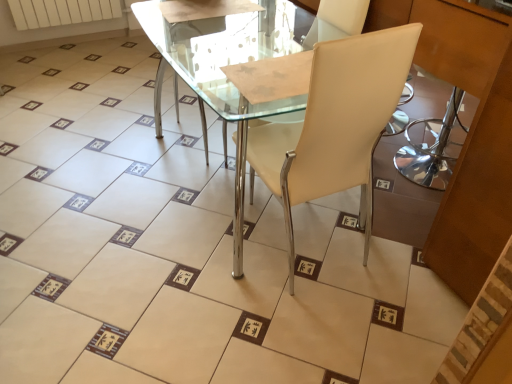
What do you see at coordinates (335, 125) in the screenshot?
I see `beige leather chair at center` at bounding box center [335, 125].

Image resolution: width=512 pixels, height=384 pixels. I want to click on beige leather chair at center, so click(x=335, y=125).

Find the location of a particular element. Image resolution: width=512 pixels, height=384 pixels. round table on the left side of beige leather chair at center is located at coordinates (209, 55).

Does transparent glass table at center have a smaller size compared to beige leather chair at center?

Yes.

In the image, is transparent glass table at center on the left side or the right side of beige leather chair at center?

Clearly, transparent glass table at center is on the left of beige leather chair at center in the image.

Who is shorter, white matte radiator at upper left or beige leather chair at center?

With less height is white matte radiator at upper left.

Considering the sizes of objects white matte radiator at upper left and beige leather chair at center in the image provided, who is thinner, white matte radiator at upper left or beige leather chair at center?

white matte radiator at upper left.

Looking at this image, from a real-world perspective, is white matte radiator at upper left above or below beige leather chair at center?

In terms of real-world spatial position, white matte radiator at upper left is below beige leather chair at center.

In order to click on chair that is below the white matte radiator at upper left (from the image's perspective) in this screenshot , I will do `click(335, 125)`.

From a real-world perspective, which object stands above the other?

beige leather chair at center is physically above.

I want to click on round table that is above the beige leather chair at center (from the image's perspective), so click(x=209, y=55).

Which of these two, beige leather chair at center or transparent glass table at center, is smaller?

With smaller size is transparent glass table at center.

Choose the correct answer: Is transparent glass table at center inside white matte radiator at upper left or outside it?

transparent glass table at center exists outside the volume of white matte radiator at upper left.

Where is `round table lying below the white matte radiator at upper left (from the image's perspective)`? round table lying below the white matte radiator at upper left (from the image's perspective) is located at coordinates (209, 55).

Are transparent glass table at center and white matte radiator at upper left making contact?

transparent glass table at center and white matte radiator at upper left are clearly separated.

How far apart are transparent glass table at center and white matte radiator at upper left?

1.67 meters.

Measure the distance from white matte radiator at upper left to transparent glass table at center.

The distance of white matte radiator at upper left from transparent glass table at center is 5.47 feet.

From the picture: From the image's perspective, is white matte radiator at upper left under transparent glass table at center?

Actually, white matte radiator at upper left appears above transparent glass table at center in the image.

Where is `round table lying in front of the white matte radiator at upper left`? This screenshot has height=384, width=512. round table lying in front of the white matte radiator at upper left is located at coordinates (209, 55).

Is beige leather chair at center in front of white matte radiator at upper left?

Yes, beige leather chair at center is in front of white matte radiator at upper left.

Considering the points (295, 148) and (70, 22), which point is behind, point (295, 148) or point (70, 22)?

Point (70, 22)

How many degrees apart are the facing directions of beige leather chair at center and white matte radiator at upper left?

beige leather chair at center and white matte radiator at upper left are facing 1.26 degrees away from each other.

Would you say white matte radiator at upper left is part of beige leather chair at center's contents?

No, white matte radiator at upper left is located outside of beige leather chair at center.

At what (x,y) coordinates should I click in order to perform the action: click on round table located above the beige leather chair at center (from the image's perspective). Please return your answer as a coordinate pair (x, y). The height and width of the screenshot is (384, 512). Looking at the image, I should click on (209, 55).

What are the coordinates of `radiator lying behind the beige leather chair at center` in the screenshot? It's located at (61, 12).

Considering their positions, is transparent glass table at center positioned closer to beige leather chair at center than white matte radiator at upper left?

transparent glass table at center lies closer to beige leather chair at center than the other object.

Based on their spatial positions, is white matte radiator at upper left or transparent glass table at center closer to beige leather chair at center?

transparent glass table at center.

Which object lies further to the anchor point white matte radiator at upper left, transparent glass table at center or beige leather chair at center?

beige leather chair at center lies further to white matte radiator at upper left than the other object.

From the picture: Based on their spatial positions, is beige leather chair at center or transparent glass table at center further from white matte radiator at upper left?

The object further to white matte radiator at upper left is beige leather chair at center.

Looking at the image, which one is located further to transparent glass table at center, beige leather chair at center or white matte radiator at upper left?

The object further to transparent glass table at center is white matte radiator at upper left.

Considering their positions, is white matte radiator at upper left positioned further to transparent glass table at center than beige leather chair at center?

The object further to transparent glass table at center is white matte radiator at upper left.

Where is `round table between beige leather chair at center and white matte radiator at upper left in the front-back direction`? The image size is (512, 384). round table between beige leather chair at center and white matte radiator at upper left in the front-back direction is located at coordinates tap(209, 55).